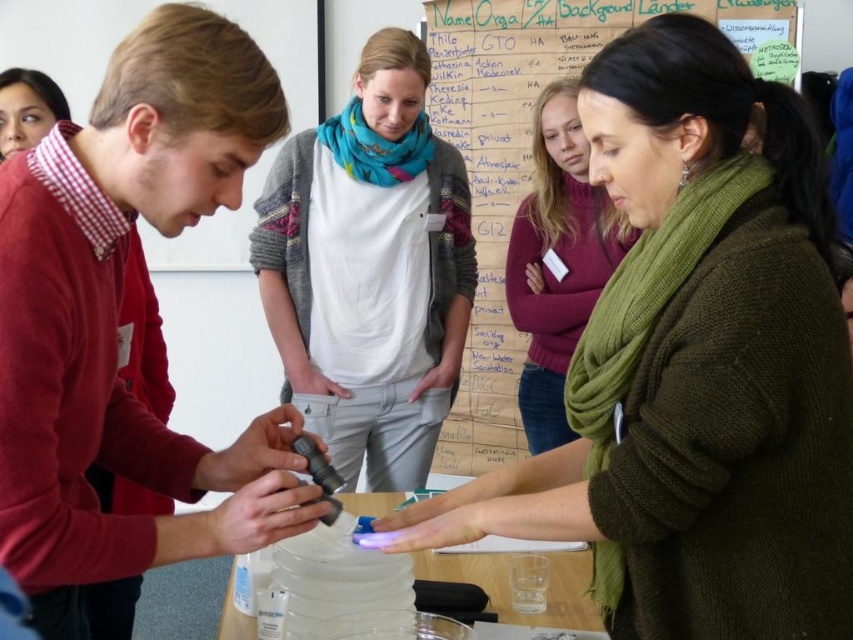
Question: Among these objects, which one is farthest from the camera?

Choices:
 (A) wooden noticeboard at upper center
 (B) matte black phone at left
 (C) clear plastic table at center
 (D) matte black scarf at upper left

Answer: (A)

Question: Does matte black phone at left have a larger size compared to wooden noticeboard at upper center?

Choices:
 (A) yes
 (B) no

Answer: (B)

Question: In this image, where is matte black phone at left located relative to matte black scarf at upper left?

Choices:
 (A) above
 (B) below

Answer: (B)

Question: Which is nearer to the clear plastic table at center?

Choices:
 (A) matte black scarf at upper left
 (B) white cotton shirt at center

Answer: (B)

Question: Is wooden noticeboard at upper center further to the viewer compared to clear plastic table at center?

Choices:
 (A) no
 (B) yes

Answer: (B)

Question: Which point is closer to the camera taking this photo?

Choices:
 (A) pos(573,156)
 (B) pos(469,88)
 (C) pos(3,92)

Answer: (C)